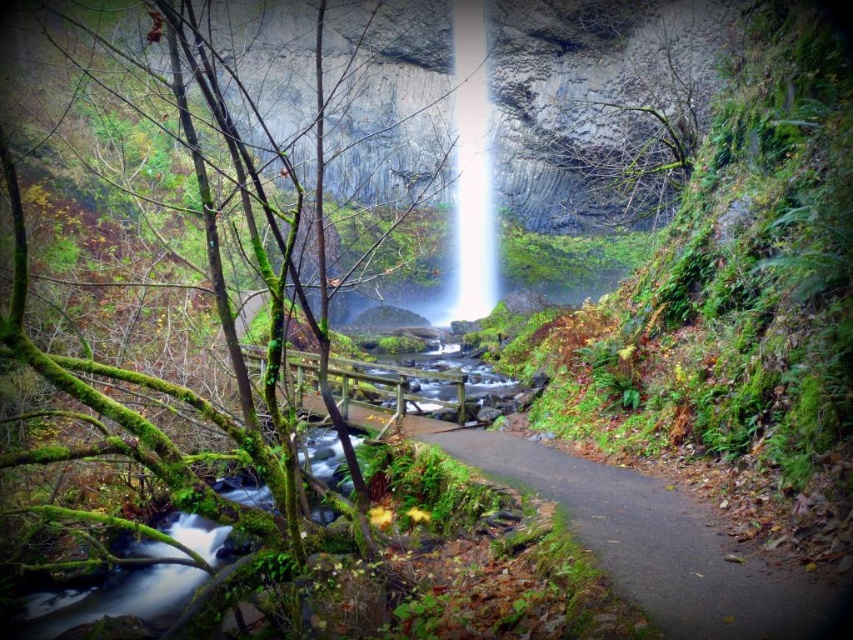
You are a hiker standing at the start of the brown dirt path at center. You want to reach the top of the white translucent waterfall at center. Is the path visible from the waterfall? Please explain.

The brown dirt path at center is not as tall as the white translucent waterfall at center, so the path is lower in elevation. Since the path is in the foreground and the waterfall is centrally positioned, the path would be visible from the waterfall as it leads towards it.

You are standing at the point marked by the coordinates point (190, 388) in the image. Looking towards the waterfall, which direction should you walk to reach the waterfall?

The green mossy tree at center is represented by point (190, 388). Since the waterfall is centrally positioned in the scene, you should walk towards the center of the image to reach the waterfall.